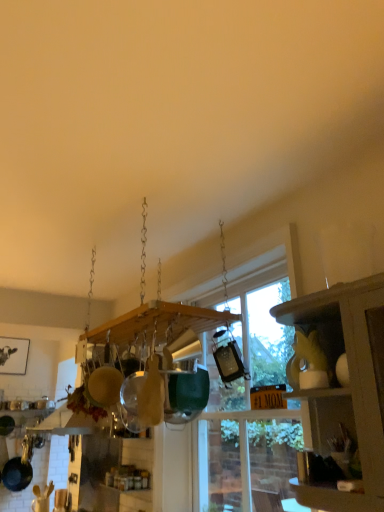
Question: From a real-world perspective, is black matte frying pan at lower left above or below matte yellow cabinet at right?

Choices:
 (A) above
 (B) below

Answer: (B)

Question: Is point (8, 460) positioned closer to the camera than point (364, 426)?

Choices:
 (A) closer
 (B) farther

Answer: (B)

Question: Which of these objects is positioned farthest from the matte yellow cabinet at right?

Choices:
 (A) transparent glass window at center
 (B) black matte frying pan at lower left

Answer: (B)

Question: Considering the real-world distances, which object is closest to the black matte frying pan at lower left?

Choices:
 (A) matte yellow cabinet at right
 (B) transparent glass window at center

Answer: (B)